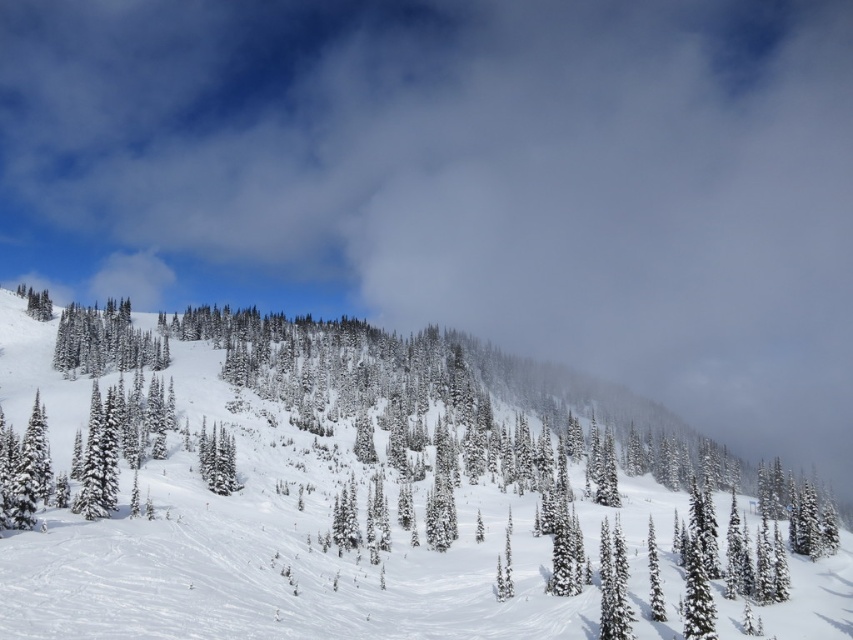
Question: Which of these objects is positioned closest to the white fluffy snow at center?

Choices:
 (A) white snow-covered tree at lower left
 (B) white snow-covered tree at lower right
 (C) green matte tree at center
 (D) green matte tree at lower right

Answer: (C)

Question: Does snow-covered pine tree at center-left appear over green matte tree at lower right?

Choices:
 (A) yes
 (B) no

Answer: (A)

Question: Can you confirm if white snow-covered tree at lower left is positioned above green matte tree at lower right?

Choices:
 (A) yes
 (B) no

Answer: (A)

Question: Which of the following is the farthest from the observer?

Choices:
 (A) green matte tree at center
 (B) green matte tree at lower right
 (C) white snow-covered tree at lower right
 (D) white snow-covered tree at lower left

Answer: (A)

Question: Does white snow-covered tree at lower left have a smaller size compared to green matte tree at center?

Choices:
 (A) no
 (B) yes

Answer: (B)

Question: Among these points, which one is nearest to the camera?

Choices:
 (A) tap(25, 436)
 (B) tap(144, 333)
 (C) tap(221, 492)

Answer: (A)